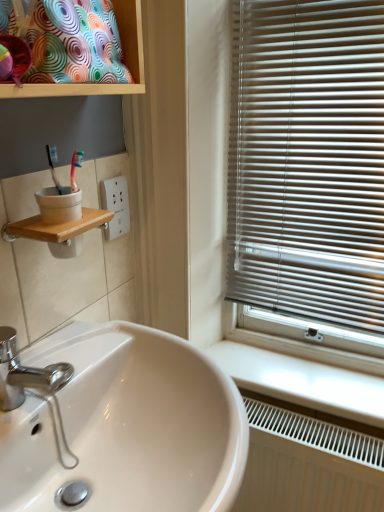
Describe the element at coordinates (99, 84) in the screenshot. I see `multicolored fabric cushion at upper left` at that location.

The image size is (384, 512). In order to click on white glossy sink at lower left in this screenshot , I will do `click(127, 426)`.

Is multicolored fabric cushion at upper left bigger than white plastic socket at upper center?

Correct, multicolored fabric cushion at upper left is larger in size than white plastic socket at upper center.

Would you say white plastic socket at upper center is part of multicolored fabric cushion at upper left's contents?

Actually, white plastic socket at upper center is outside multicolored fabric cushion at upper left.

Can you tell me how much multicolored fabric cushion at upper left and white plastic socket at upper center differ in facing direction?

The facing directions of multicolored fabric cushion at upper left and white plastic socket at upper center are 2.85 degrees apart.

Is multicolored fabric cushion at upper left not close to white plastic socket at upper center?

No, multicolored fabric cushion at upper left is not far away from white plastic socket at upper center.

Where is `counter top located on the right of white glossy sink at lower left`? Image resolution: width=384 pixels, height=512 pixels. counter top located on the right of white glossy sink at lower left is located at coordinates (303, 381).

Between white glossy sink at lower left and white glossy counter top at lower right, which one appears on the right side from the viewer's perspective?

white glossy counter top at lower right.

Considering the points (102, 331) and (248, 368), which point is in front, point (102, 331) or point (248, 368)?

The point (102, 331) is in front.

Is white textured radiator at lower right far away from white glossy sink at lower left?

That's not correct — white textured radiator at lower right is a little close to white glossy sink at lower left.

From the picture: Would you say white textured radiator at lower right is outside white glossy sink at lower left?

white textured radiator at lower right lies outside white glossy sink at lower left's area.

Is white textured radiator at lower right facing away from white glossy sink at lower left?

white textured radiator at lower right does not have its back to white glossy sink at lower left.

Is point (333, 451) behind point (71, 509)?

That is True.

Can you tell me how much white plastic socket at upper center and white textured radiator at lower right differ in facing direction?

The facing directions of white plastic socket at upper center and white textured radiator at lower right are 89.8 degrees apart.

Which of these two, white plastic socket at upper center or white textured radiator at lower right, stands shorter?

With less height is white plastic socket at upper center.

From the image's perspective, is white plastic socket at upper center positioned above or below white textured radiator at lower right?

white plastic socket at upper center is above white textured radiator at lower right.

Is there a large distance between white plastic socket at upper center and white textured radiator at lower right?

No, white plastic socket at upper center is not far from white textured radiator at lower right.

Is white glossy counter top at lower right located within white textured radiator at lower right?

No, white glossy counter top at lower right is not inside white textured radiator at lower right.

Between white textured radiator at lower right and white glossy counter top at lower right, which one appears on the right side from the viewer's perspective?

white textured radiator at lower right is more to the right.

Who is shorter, white textured radiator at lower right or white glossy counter top at lower right?

Standing shorter between the two is white glossy counter top at lower right.

Is white textured radiator at lower right wider or thinner than white glossy counter top at lower right?

white textured radiator at lower right is thinner than white glossy counter top at lower right.

Does white glossy counter top at lower right appear on the right side of multicolored fabric cushion at upper left?

Yes, white glossy counter top at lower right is to the right of multicolored fabric cushion at upper left.

How many degrees apart are the facing directions of white glossy counter top at lower right and multicolored fabric cushion at upper left?

The angular difference between white glossy counter top at lower right and multicolored fabric cushion at upper left is 86.8 degrees.

Locate an element on the screen. The image size is (384, 512). cabinet that is on the left side of white glossy counter top at lower right is located at coordinates (99, 84).

Between white glossy counter top at lower right and multicolored fabric cushion at upper left, which one has smaller size?

Smaller between the two is white glossy counter top at lower right.

From the image's perspective, would you say white glossy sink at lower left is shown under white textured radiator at lower right?

No, from the image's perspective, white glossy sink at lower left is not below white textured radiator at lower right.

From a real-world perspective, relative to white textured radiator at lower right, is white glossy sink at lower left vertically above or below?

white glossy sink at lower left is situated higher than white textured radiator at lower right in the real world.

How different are the orientations of white glossy sink at lower left and white textured radiator at lower right in degrees?

90.7 degrees separate the facing orientations of white glossy sink at lower left and white textured radiator at lower right.

Between white glossy sink at lower left and white textured radiator at lower right, which one appears on the left side from the viewer's perspective?

Positioned to the left is white glossy sink at lower left.

The height and width of the screenshot is (512, 384). In order to click on electric outlet on the right of multicolored fabric cushion at upper left in this screenshot , I will do `click(116, 205)`.

You are a GUI agent. You are given a task and a screenshot of the screen. Output one action in this format:
    pyautogui.click(x=<x>, y=<y>)
    Task: Click on the sink located below the white glossy counter top at lower right (from the image's perspective)
    This screenshot has height=512, width=384.
    Given the screenshot: What is the action you would take?
    pyautogui.click(x=127, y=426)

Estimate the real-world distances between objects in this image. Which object is further from white glossy counter top at lower right, white textured radiator at lower right or multicolored fabric cushion at upper left?

Among the two, multicolored fabric cushion at upper left is located further to white glossy counter top at lower right.

Which object lies further to the anchor point white glossy counter top at lower right, multicolored fabric cushion at upper left or white plastic socket at upper center?

Based on the image, multicolored fabric cushion at upper left appears to be further to white glossy counter top at lower right.

Based on their spatial positions, is white plastic socket at upper center or white glossy counter top at lower right further from white textured radiator at lower right?

white plastic socket at upper center.

From the picture: Which object lies nearer to the anchor point white glossy counter top at lower right, multicolored fabric cushion at upper left or white glossy sink at lower left?

white glossy sink at lower left lies closer to white glossy counter top at lower right than the other object.

Looking at the image, which one is located further to white glossy sink at lower left, multicolored fabric cushion at upper left or white plastic socket at upper center?

multicolored fabric cushion at upper left lies further to white glossy sink at lower left than the other object.

When comparing their distances from white glossy counter top at lower right, does white plastic socket at upper center or white textured radiator at lower right seem further?

Among the two, white plastic socket at upper center is located further to white glossy counter top at lower right.

Looking at the image, which one is located closer to white plastic socket at upper center, white glossy counter top at lower right or multicolored fabric cushion at upper left?

Based on the image, multicolored fabric cushion at upper left appears to be nearer to white plastic socket at upper center.

Looking at this image, estimate the real-world distances between objects in this image. Which object is further from white glossy sink at lower left, white plastic socket at upper center or multicolored fabric cushion at upper left?

multicolored fabric cushion at upper left lies further to white glossy sink at lower left than the other object.

At what (x,y) coordinates should I click in order to perform the action: click on electric outlet between multicolored fabric cushion at upper left and white glossy counter top at lower right in the up-down direction. Please return your answer as a coordinate pair (x, y). Looking at the image, I should click on (116, 205).

The width and height of the screenshot is (384, 512). I want to click on counter top that lies between white plastic socket at upper center and white textured radiator at lower right from top to bottom, so click(303, 381).

The height and width of the screenshot is (512, 384). I want to click on sink between multicolored fabric cushion at upper left and white textured radiator at lower right in the up-down direction, so click(x=127, y=426).

Image resolution: width=384 pixels, height=512 pixels. I want to click on radiator positioned between white glossy sink at lower left and white glossy counter top at lower right from near to far, so click(x=308, y=464).